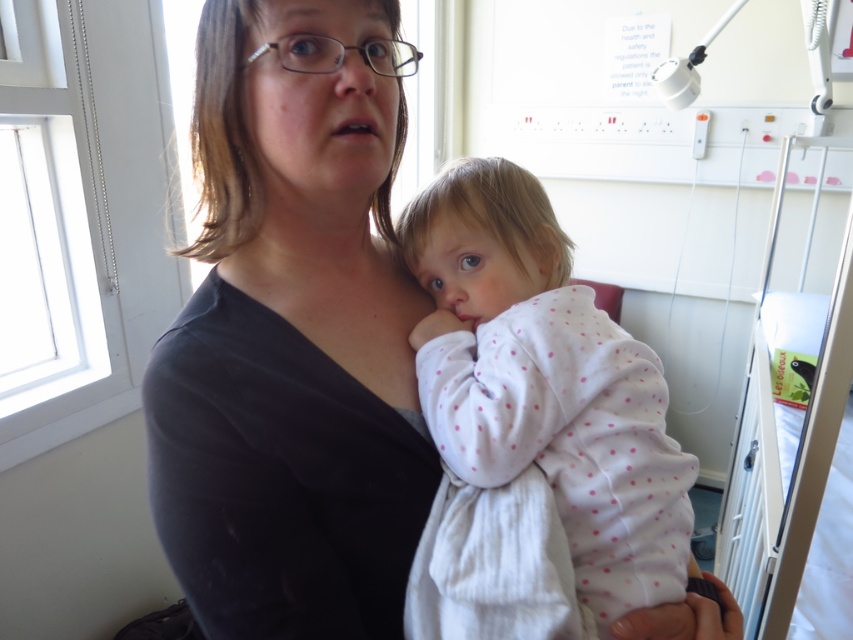
Does matte black shirt at center have a smaller size compared to white polka dot fabric at center?

No, matte black shirt at center is not smaller than white polka dot fabric at center.

Is point (289, 17) closer to viewer compared to point (585, 538)?

Yes.

Is point (250, 48) less distant than point (656, 385)?

Yes.

Locate an element on the screen. The height and width of the screenshot is (640, 853). matte black shirt at center is located at coordinates (291, 340).